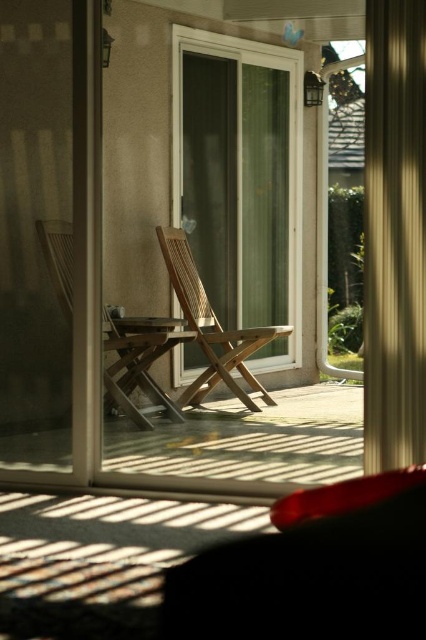
Looking at this image, between white wood door at center and wooden chair at center, which one appears on the right side from the viewer's perspective?

Positioned to the right is white wood door at center.

Which is more to the left, white wood door at center or wooden chair at center?

wooden chair at center is more to the left.

The image size is (426, 640). Find the location of `white wood door at center`. white wood door at center is located at coordinates (241, 179).

Is beige fabric curtain at right smaller than natural wood chair at center?

Incorrect, beige fabric curtain at right is not smaller in size than natural wood chair at center.

Who is lower down, beige fabric curtain at right or natural wood chair at center?

natural wood chair at center

Is point (394, 154) closer to camera compared to point (238, 365)?

Yes, point (394, 154) is in front of point (238, 365).

Locate an element on the screen. This screenshot has width=426, height=640. beige fabric curtain at right is located at coordinates (394, 234).

Based on the photo, who is higher up, white wood door at center or beige fabric curtain at right?

white wood door at center is higher up.

Is white wood door at center to the left of beige fabric curtain at right from the viewer's perspective?

Correct, you'll find white wood door at center to the left of beige fabric curtain at right.

This screenshot has width=426, height=640. Find the location of `white wood door at center`. white wood door at center is located at coordinates (241, 179).